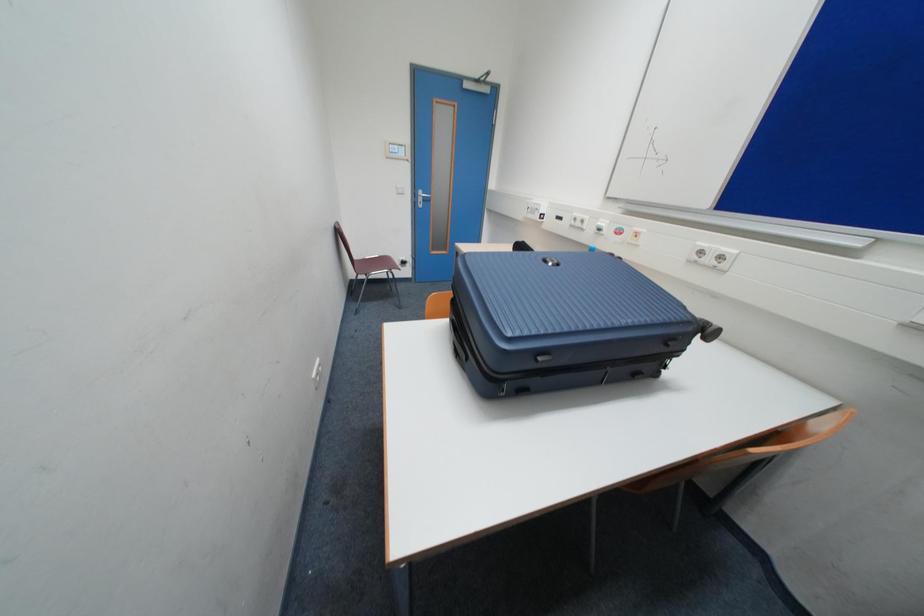
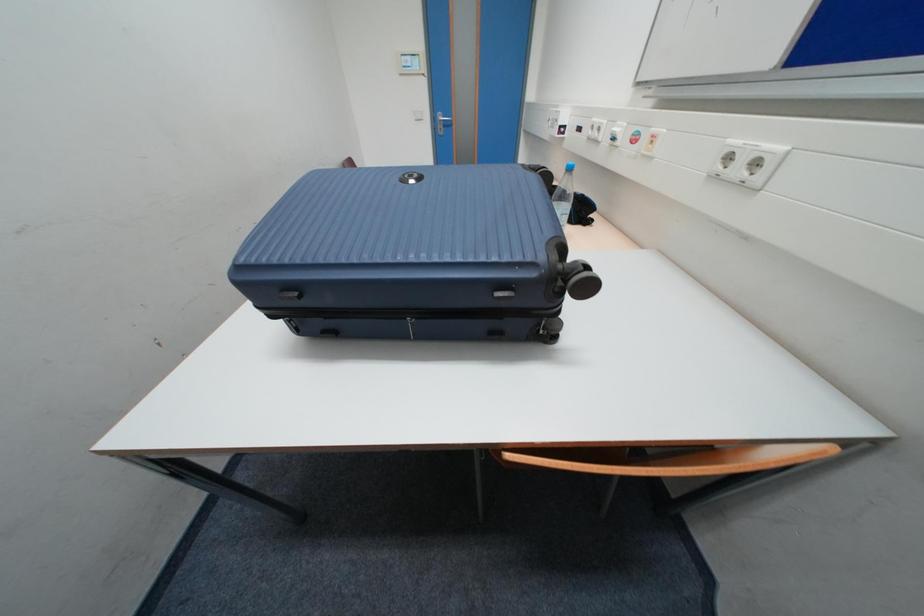
Question: The images are taken continuously from a first-person perspective. In which direction is your viewpoint rotating?

Choices:
 (A) Left
 (B) Right
 (C) Up
 (D) Down

Answer: (A)